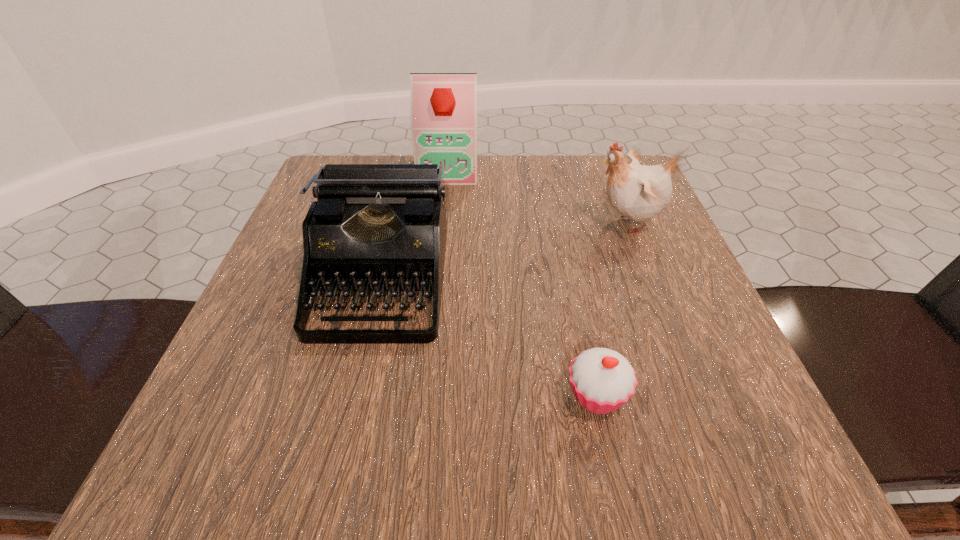
Locate an element on the screen. This screenshot has width=960, height=540. the tallest object is located at coordinates (443, 116).

Locate an element on the screen. The width and height of the screenshot is (960, 540). the farthest object is located at coordinates (443, 116).

Identify the location of bird. Image resolution: width=960 pixels, height=540 pixels. (639, 192).

At what (x,y) coordinates should I click in order to perform the action: click on the third shortest object. Please return your answer as a coordinate pair (x, y). Looking at the image, I should click on (639, 192).

Identify the location of typewriter. (375, 227).

You are a GUI agent. You are given a task and a screenshot of the screen. Output one action in this format:
    pyautogui.click(x=<x>, y=<y>)
    Task: Click on the cupcake
    This screenshot has width=960, height=540.
    Given the screenshot: What is the action you would take?
    pyautogui.click(x=602, y=380)

The width and height of the screenshot is (960, 540). Identify the location of the nearest object. (602, 380).

You are a GUI agent. You are given a task and a screenshot of the screen. Output one action in this format:
    pyautogui.click(x=<x>, y=<y>)
    Task: Click on the free space located with the cap open on the farthest object
    
    Given the screenshot: What is the action you would take?
    pyautogui.click(x=444, y=206)

Where is `vacant region located at the beak of the rightmost object`? This screenshot has height=540, width=960. vacant region located at the beak of the rightmost object is located at coordinates (480, 223).

The height and width of the screenshot is (540, 960). In order to click on free location located at the beak of the rightmost object in this screenshot , I will do `click(475, 223)`.